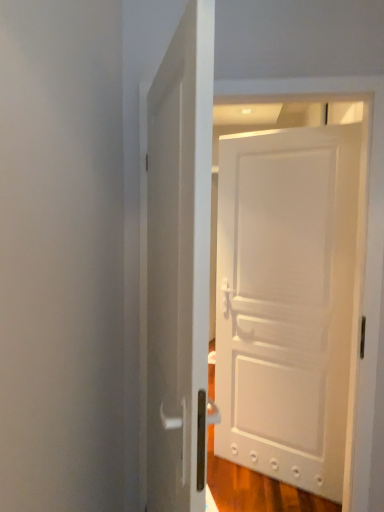
Question: In which direction should I rotate to look at white glossy door at center, marked as the second door in a back-to-front arrangement?

Choices:
 (A) right
 (B) left

Answer: (B)

Question: Does white glossy door at center, marked as the second door in a back-to-front arrangement, have a greater width compared to white matte door at center, acting as the 1th door starting from the back?

Choices:
 (A) yes
 (B) no

Answer: (A)

Question: Is white glossy door at center, which is the 2th door in right-to-left order, closer to the viewer compared to white matte door at center, which is the 2th door in left-to-right order?

Choices:
 (A) no
 (B) yes

Answer: (B)

Question: Would you say white glossy door at center, which is the first door in front-to-back order, is outside white matte door at center, which is the 2th door in left-to-right order?

Choices:
 (A) no
 (B) yes

Answer: (B)

Question: From a real-world perspective, is white glossy door at center, which is the 2th door in right-to-left order, physically below white matte door at center, acting as the 1th door starting from the back?

Choices:
 (A) no
 (B) yes

Answer: (A)

Question: From the image's perspective, would you say white glossy door at center, which is the first door in front-to-back order, is positioned over white matte door at center, acting as the 1th door starting from the back?

Choices:
 (A) yes
 (B) no

Answer: (A)

Question: Is white glossy door at center, placed as the 1th door when sorted from left to right, behind white matte door at center, the 2th door positioned from the front?

Choices:
 (A) yes
 (B) no

Answer: (B)

Question: Is white matte door at center, acting as the 1th door starting from the back, facing towards white glossy door at center, which is the 2th door in right-to-left order?

Choices:
 (A) yes
 (B) no

Answer: (A)

Question: Is white matte door at center, the 2th door positioned from the front, thinner than white glossy door at center, placed as the 1th door when sorted from left to right?

Choices:
 (A) yes
 (B) no

Answer: (A)

Question: Is white matte door at center, which is counted as the 1th door, starting from the right, outside of white glossy door at center, which is the first door in front-to-back order?

Choices:
 (A) yes
 (B) no

Answer: (A)

Question: Does white matte door at center, which is counted as the 1th door, starting from the right, appear on the left side of white glossy door at center, which is the first door in front-to-back order?

Choices:
 (A) no
 (B) yes

Answer: (A)

Question: Is white matte door at center, which is the 2th door in left-to-right order, to the right of white glossy door at center, marked as the second door in a back-to-front arrangement, from the viewer's perspective?

Choices:
 (A) yes
 (B) no

Answer: (A)

Question: From a real-world perspective, is white matte door at center, which is counted as the 1th door, starting from the right, under white glossy door at center, placed as the 1th door when sorted from left to right?

Choices:
 (A) no
 (B) yes

Answer: (B)

Question: Considering the positions of point (347, 304) and point (155, 204), is point (347, 304) closer or farther from the camera than point (155, 204)?

Choices:
 (A) farther
 (B) closer

Answer: (A)